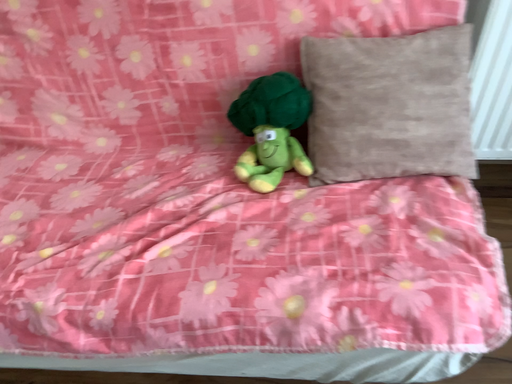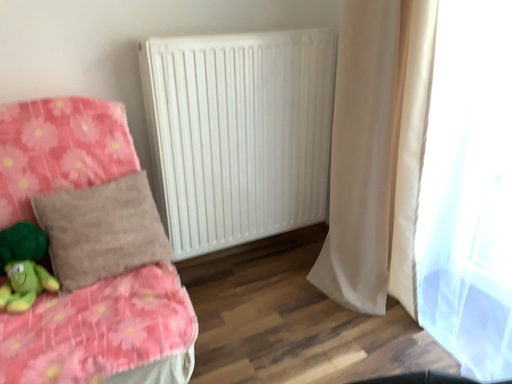
Question: How did the camera likely rotate when shooting the video?

Choices:
 (A) rotated right
 (B) rotated left

Answer: (A)